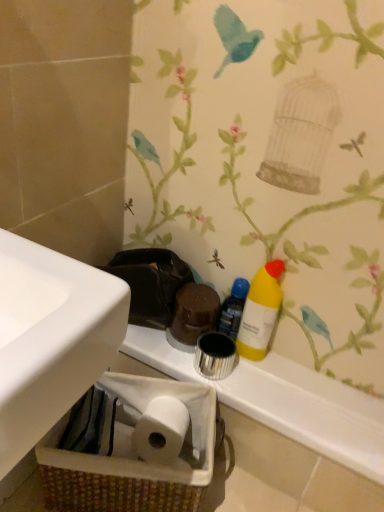
Where is `free location in front of yellow matte bottle at center right`? This screenshot has height=512, width=384. free location in front of yellow matte bottle at center right is located at coordinates (276, 389).